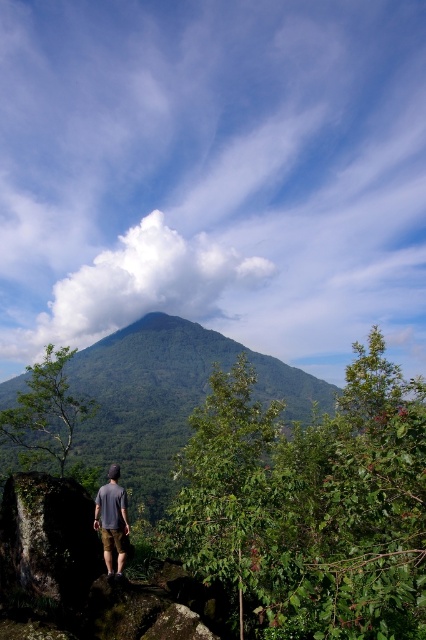
Question: Is green leafy mountain at center thinner than gray cotton shirt at center?

Choices:
 (A) yes
 (B) no

Answer: (B)

Question: Which of the following is the farthest from the observer?

Choices:
 (A) (98, 492)
 (B) (94, 380)

Answer: (B)

Question: Which of the following is the farthest from the observer?

Choices:
 (A) green leafy mountain at center
 (B) gray cotton shirt at center

Answer: (A)

Question: Which point is closer to the camera?

Choices:
 (A) gray cotton shirt at center
 (B) green leafy mountain at center

Answer: (A)

Question: Can you confirm if green leafy mountain at center is positioned above gray cotton shirt at center?

Choices:
 (A) yes
 (B) no

Answer: (B)

Question: Does green leafy mountain at center have a lesser width compared to gray cotton shirt at center?

Choices:
 (A) yes
 (B) no

Answer: (B)